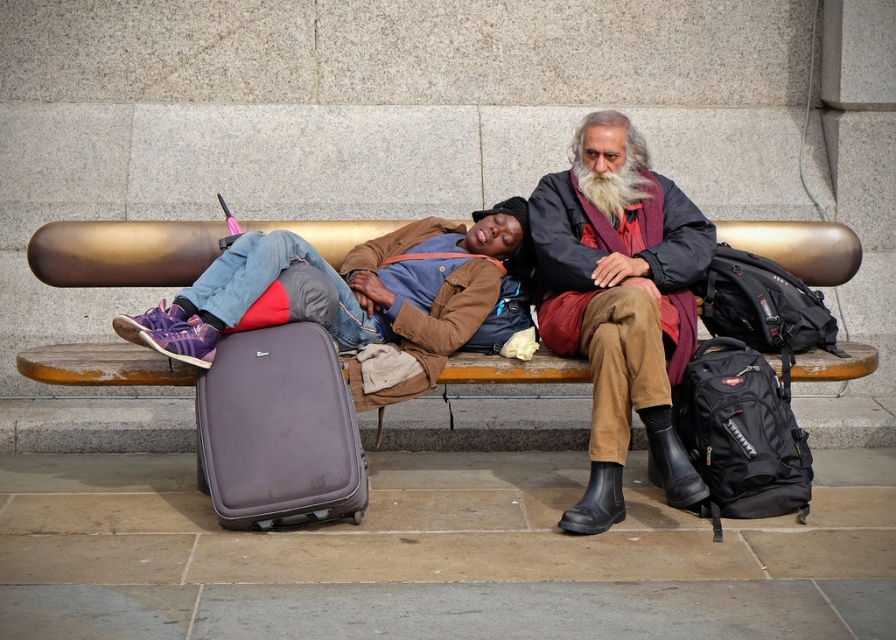
You are standing in front of the public bench and want to place a small gift on the brown suede jacket at center. Based on the coordinates provided, where should you aim to place the gift?

The brown suede jacket at center is located at coordinates point (619,301), so you should aim for that position to place the small gift.